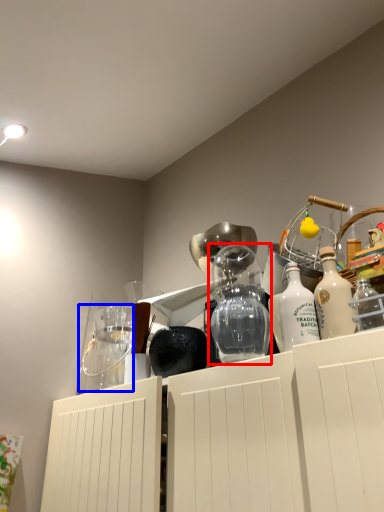
Question: Which object appears farthest to the camera in this image, glass vase (highlighted by a red box) or glass jar (highlighted by a blue box)?

Choices:
 (A) glass vase
 (B) glass jar

Answer: (B)